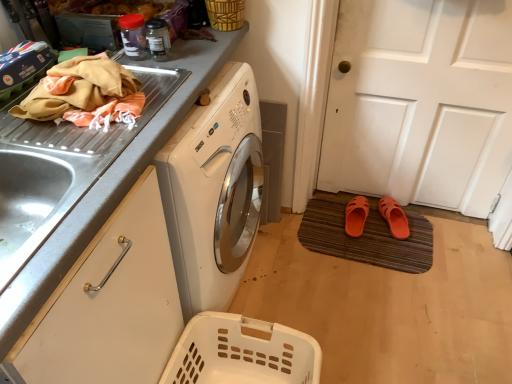
I want to click on vacant space positioned to the left of orange rubber slipper at lower center, arranged as the first footwear when viewed from the left, so click(x=321, y=224).